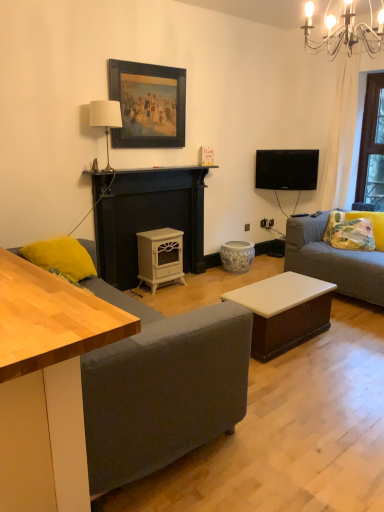
Locate an element on the screen. The height and width of the screenshot is (512, 384). vacant area on top of white glossy coffee table at center (from a real-world perspective) is located at coordinates (279, 284).